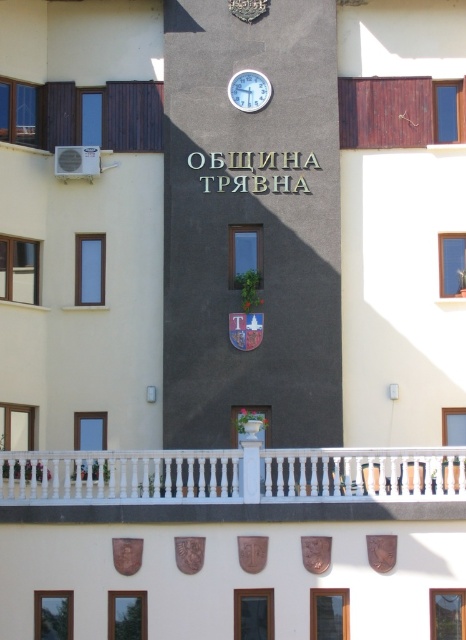
Consider the image. You are an architect designing a new building and want to ensure that the white wooden railing at center and the white plastic clock at upper center are proportionate. Based on the image, which object is taller?

The white wooden railing at center is taller than the white plastic clock at upper center according to the description.

You are a visitor standing in front of the building and want to see both the white wooden railing at center and the white plastic clock at upper center. Which object is located higher up on the building?

The white plastic clock at upper center is located higher up on the building than the white wooden railing at center.